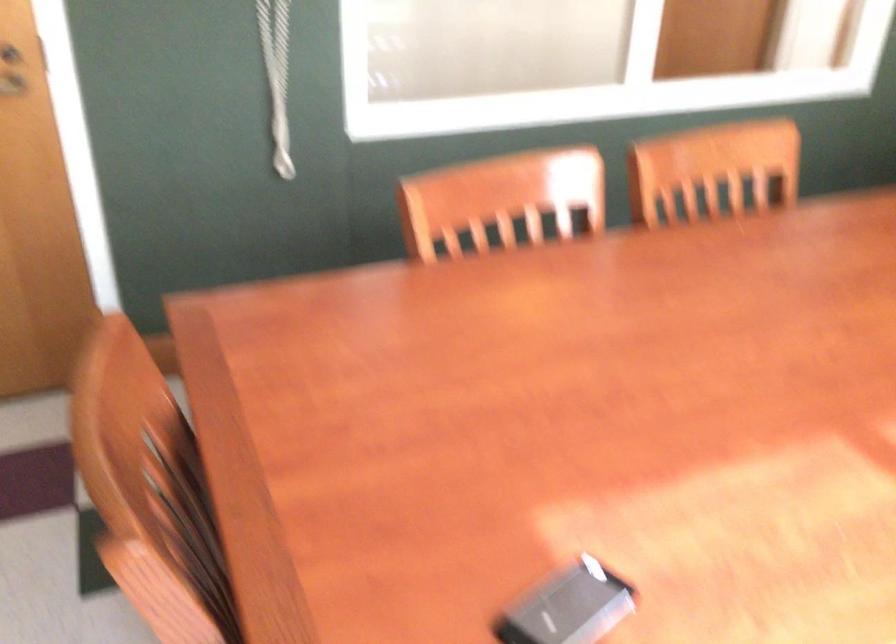
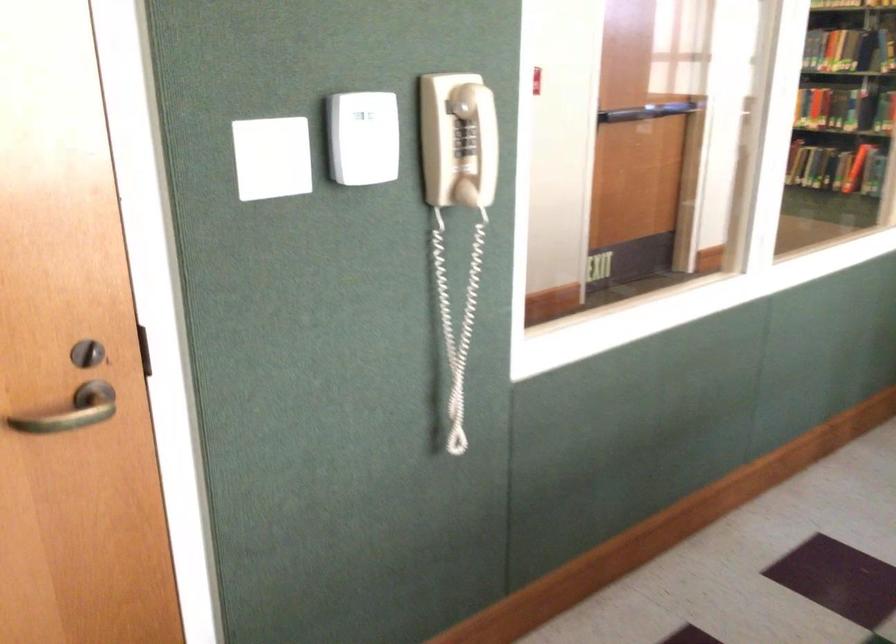
Consider the image. Which direction would the cameraman need to move to produce the second image?

The cameraman moved toward left, forward.